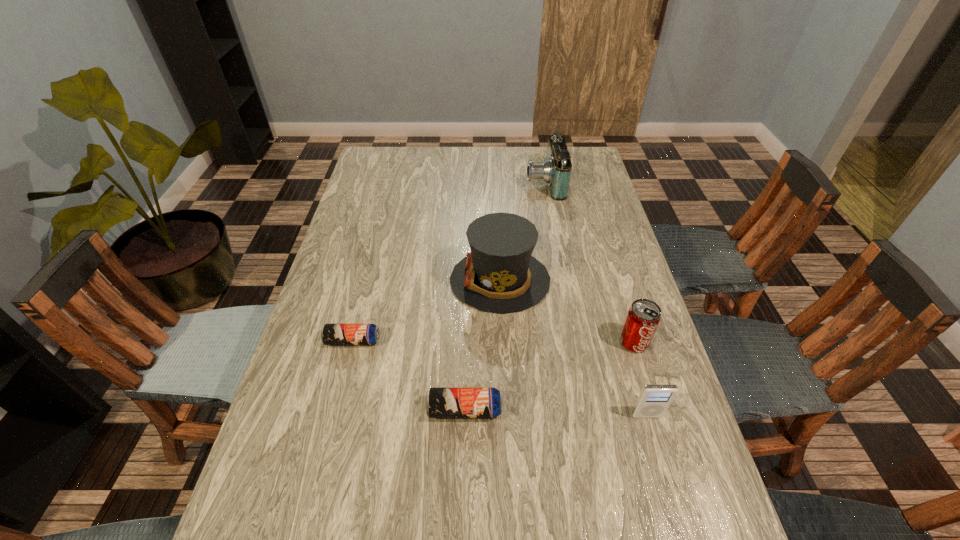
Please point a vacant point for placing a beer can on the right. Please provide its 2D coordinates. Your answer should be formatted as a tuple, i.e. [(x, y)], where the tuple contains the x and y coordinates of a point satisfying the conditions above.

[(612, 501)]